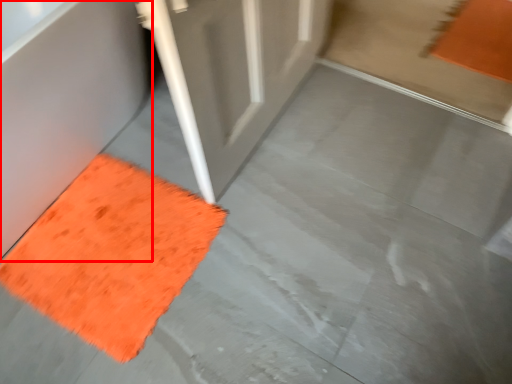
Question: In this image, where is bath (annotated by the red box) located relative to mat?

Choices:
 (A) right
 (B) left

Answer: (B)